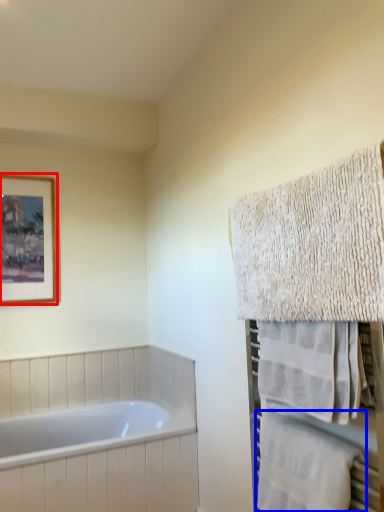
Question: Among these objects, which one is farthest to the camera, picture frame (highlighted by a red box) or towel (highlighted by a blue box)?

Choices:
 (A) picture frame
 (B) towel

Answer: (A)